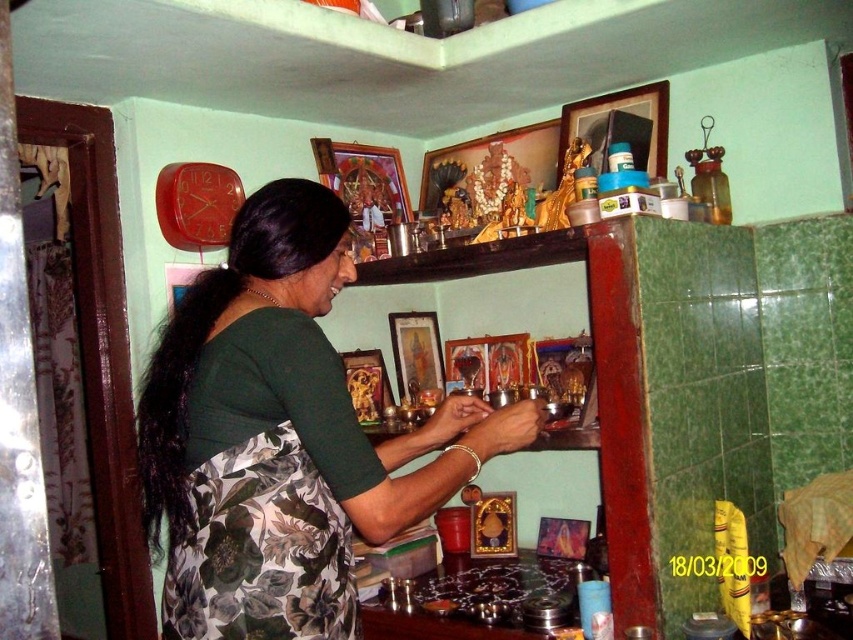
You are an interior designer assessing the layout of this domestic space. You notice the green fabric sari at center and the floral fabric apron at lower left. Which item occupies a larger vertical space in the scene?

The green fabric sari at center has a greater height compared to the floral fabric apron at lower left, so it occupies a larger vertical space in the scene.

You are standing in front of the wooden shelf or altar in the scene. There are two points marked on the shelf, one at coordinates point (383,458) and another at point (233,625). Which of these two points is closer to you?

Point (383,458) is closer to you because it is further to the viewer than point (233,625).